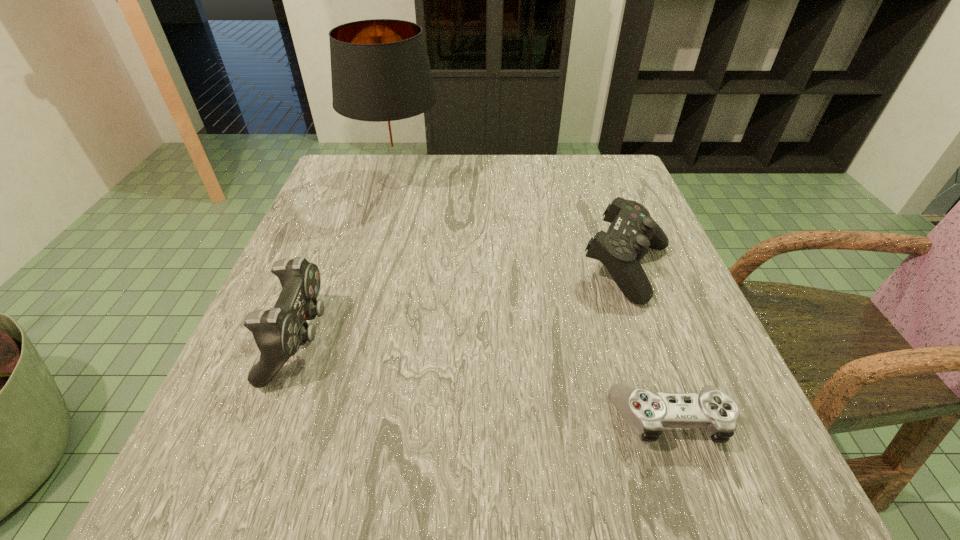
Image resolution: width=960 pixels, height=540 pixels. Identify the location of vacant space at the near left corner. (276, 508).

Locate an element on the screen. Image resolution: width=960 pixels, height=540 pixels. vacant region at the far right corner of the desktop is located at coordinates (604, 155).

The height and width of the screenshot is (540, 960). Find the location of `vacant space in between the shortest control and the second tallest control`. vacant space in between the shortest control and the second tallest control is located at coordinates (648, 344).

Locate an element on the screen. The height and width of the screenshot is (540, 960). free point between the farthest object and the shortest object is located at coordinates (534, 300).

This screenshot has height=540, width=960. Find the location of `free area in between the third shortest object and the shortest object`. free area in between the third shortest object and the shortest object is located at coordinates (485, 380).

This screenshot has width=960, height=540. Find the location of `free space between the second tallest control and the third shortest object`. free space between the second tallest control and the third shortest object is located at coordinates (464, 304).

At what (x,y) coordinates should I click in order to perform the action: click on vacant point located between the tallest object and the third shortest object. Please return your answer as a coordinate pair (x, y). Looking at the image, I should click on (348, 260).

The height and width of the screenshot is (540, 960). I want to click on empty space between the tallest control and the second shortest object, so click(x=464, y=304).

Where is `vacant space in between the lampshade and the shortest object`? vacant space in between the lampshade and the shortest object is located at coordinates pyautogui.click(x=534, y=300).

You are a GUI agent. You are given a task and a screenshot of the screen. Output one action in this format:
    pyautogui.click(x=<x>, y=<y>)
    Task: Click on the free point between the shortest control and the lampshade
    This screenshot has height=540, width=960.
    Given the screenshot: What is the action you would take?
    pyautogui.click(x=534, y=300)